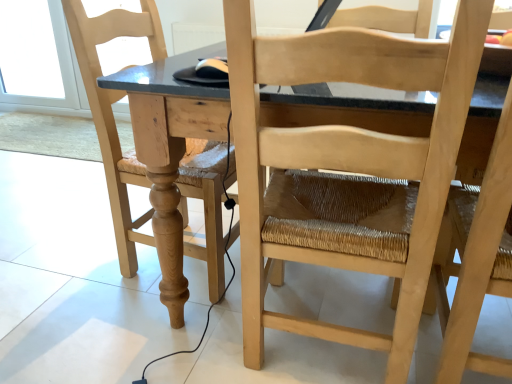
What is the approximate width of natural wood chair at center, placed as the second chair when sorted from left to right?

It is 20.10 inches.

Describe the element at coordinates (59, 67) in the screenshot. I see `transparent glass door at upper left` at that location.

The image size is (512, 384). What do you see at coordinates (347, 113) in the screenshot? I see `natural wood table at center` at bounding box center [347, 113].

Locate an element on the screen. natural wood chair at center, the 2th chair positioned from the right is located at coordinates (347, 168).

Does natural wood chair at left, the third chair positioned from the right, have a greater height compared to natural wood chair at center, the 2th chair positioned from the right?

In fact, natural wood chair at left, the third chair positioned from the right, may be shorter than natural wood chair at center, the 2th chair positioned from the right.

Considering the relative sizes of natural wood chair at left, the first chair in the left-to-right sequence, and natural wood chair at center, the 2th chair positioned from the right, in the image provided, is natural wood chair at left, the first chair in the left-to-right sequence, thinner than natural wood chair at center, the 2th chair positioned from the right,?

Indeed, natural wood chair at left, the first chair in the left-to-right sequence, has a lesser width compared to natural wood chair at center, the 2th chair positioned from the right.

Would you say natural wood chair at left, the third chair positioned from the right, is outside natural wood chair at center, placed as the second chair when sorted from left to right?

Yes, natural wood chair at left, the third chair positioned from the right, is not within natural wood chair at center, placed as the second chair when sorted from left to right.

From a real-world perspective, is natural wood chair at left, the first chair in the left-to-right sequence, above or below natural wood chair at center, placed as the second chair when sorted from left to right?

From a real-world perspective, natural wood chair at left, the first chair in the left-to-right sequence, is physically below natural wood chair at center, placed as the second chair when sorted from left to right.

Is natural wood chair at center, placed as the second chair when sorted from left to right, spatially inside natural wood table at center, or outside of it?

→ natural wood chair at center, placed as the second chair when sorted from left to right, is contained in natural wood table at center.

From a real-world perspective, is natural wood chair at center, placed as the second chair when sorted from left to right, positioned over natural wood table at center based on gravity?

Yes, from a real-world perspective, natural wood chair at center, placed as the second chair when sorted from left to right, is above natural wood table at center.

Is natural wood chair at center, the 2th chair positioned from the right, facing towards natural wood table at center?

Yes, natural wood chair at center, the 2th chair positioned from the right, is turned towards natural wood table at center.

Considering the sizes of natural wood chair at center, the 2th chair positioned from the right, and natural wood table at center in the image, is natural wood chair at center, the 2th chair positioned from the right, wider or thinner than natural wood table at center?

In the image, natural wood chair at center, the 2th chair positioned from the right, appears to be more narrow than natural wood table at center.

From the image's perspective, is natural wood chair at right, which is the 1th chair in right-to-left order, located beneath natural wood chair at center, placed as the second chair when sorted from left to right?

Indeed, from the image's perspective, natural wood chair at right, which is the 1th chair in right-to-left order, is shown beneath natural wood chair at center, placed as the second chair when sorted from left to right.

Is natural wood chair at center, placed as the second chair when sorted from left to right, at the back of natural wood chair at right, the third chair positioned from the left?

No, natural wood chair at right, the third chair positioned from the left, is not facing away from natural wood chair at center, placed as the second chair when sorted from left to right.

Is natural wood chair at right, the third chair positioned from the left, situated inside natural wood chair at center, placed as the second chair when sorted from left to right, or outside?

The correct answer is: outside.

How different are the orientations of natural wood chair at right, which is the 1th chair in right-to-left order, and natural wood chair at center, the 2th chair positioned from the right, in degrees?

The angle between the facing direction of natural wood chair at right, which is the 1th chair in right-to-left order, and the facing direction of natural wood chair at center, the 2th chair positioned from the right, is 1.54 degrees.

From a real-world perspective, is natural wood table at center positioned above or below natural wood chair at center, placed as the second chair when sorted from left to right?

Clearly, from a real-world perspective, natural wood table at center is below natural wood chair at center, placed as the second chair when sorted from left to right.

Does natural wood table at center appear on the right side of natural wood chair at center, the 2th chair positioned from the right?

Indeed, natural wood table at center is positioned on the right side of natural wood chair at center, the 2th chair positioned from the right.

From the image's perspective, is natural wood table at center located above natural wood chair at center, placed as the second chair when sorted from left to right?

Yes.

Is natural wood table at center spatially inside natural wood chair at center, placed as the second chair when sorted from left to right, or outside of it?

natural wood table at center is spatially situated outside natural wood chair at center, placed as the second chair when sorted from left to right.

Could natural wood chair at right, the third chair positioned from the left, be considered to be inside natural wood chair at center, placed as the second chair when sorted from left to right?

No, natural wood chair at right, the third chair positioned from the left, is located outside of natural wood chair at center, placed as the second chair when sorted from left to right.

Can you tell me how much natural wood chair at center, the 2th chair positioned from the right, and natural wood chair at right, the third chair positioned from the left, differ in facing direction?

There is a 1.54-degree angle between the facing directions of natural wood chair at center, the 2th chair positioned from the right, and natural wood chair at right, the third chair positioned from the left.

Between natural wood chair at center, the 2th chair positioned from the right, and natural wood chair at right, which is the 1th chair in right-to-left order, which one is positioned in front?

Positioned in front is natural wood chair at right, which is the 1th chair in right-to-left order.

Would you say natural wood chair at right, which is the 1th chair in right-to-left order, is inside or outside transparent glass door at upper left?

natural wood chair at right, which is the 1th chair in right-to-left order, cannot be found inside transparent glass door at upper left.

Are natural wood chair at right, the third chair positioned from the left, and transparent glass door at upper left far apart?

Indeed, natural wood chair at right, the third chair positioned from the left, is not near transparent glass door at upper left.

From the image's perspective, which one is positioned lower, natural wood chair at right, which is the 1th chair in right-to-left order, or transparent glass door at upper left?

natural wood chair at right, which is the 1th chair in right-to-left order, from the image's perspective.

Could you measure the distance between natural wood chair at center, placed as the second chair when sorted from left to right, and natural wood chair at left, the first chair in the left-to-right sequence?

The distance of natural wood chair at center, placed as the second chair when sorted from left to right, from natural wood chair at left, the first chair in the left-to-right sequence, is 17.58 inches.

How different are the orientations of natural wood chair at center, placed as the second chair when sorted from left to right, and natural wood chair at left, the first chair in the left-to-right sequence, in degrees?

95.2 degrees separate the facing orientations of natural wood chair at center, placed as the second chair when sorted from left to right, and natural wood chair at left, the first chair in the left-to-right sequence.

Is natural wood chair at center, the 2th chair positioned from the right, to the left or to the right of natural wood chair at left, the first chair in the left-to-right sequence, in the image?

Based on their positions, natural wood chair at center, the 2th chair positioned from the right, is located to the right of natural wood chair at left, the first chair in the left-to-right sequence.

Does natural wood chair at center, placed as the second chair when sorted from left to right, turn towards natural wood chair at left, the first chair in the left-to-right sequence?

No.

Locate an element on the screen. The image size is (512, 384). chair that is the 1st one below the natural wood chair at center, placed as the second chair when sorted from left to right (from a real-world perspective) is located at coordinates (112, 112).

The image size is (512, 384). Identify the location of table above the natural wood chair at center, placed as the second chair when sorted from left to right (from the image's perspective). [347, 113].

When comparing their distances from transparent glass door at upper left, does natural wood chair at right, the third chair positioned from the left, or natural wood chair at left, the third chair positioned from the right, seem further?

natural wood chair at right, the third chair positioned from the left, lies further to transparent glass door at upper left than the other object.

When comparing their distances from natural wood chair at center, placed as the second chair when sorted from left to right, does natural wood chair at right, which is the 1th chair in right-to-left order, or transparent glass door at upper left seem further?

transparent glass door at upper left is further to natural wood chair at center, placed as the second chair when sorted from left to right.

From the image, which object appears to be farther from transparent glass door at upper left, natural wood table at center or natural wood chair at left, the third chair positioned from the right?

natural wood table at center is positioned further to the anchor transparent glass door at upper left.

Based on their spatial positions, is natural wood chair at right, the third chair positioned from the left, or natural wood table at center further from natural wood chair at center, placed as the second chair when sorted from left to right?

natural wood chair at right, the third chair positioned from the left, is further to natural wood chair at center, placed as the second chair when sorted from left to right.

Estimate the real-world distances between objects in this image. Which object is further from natural wood chair at center, the 2th chair positioned from the right, natural wood chair at left, the first chair in the left-to-right sequence, or natural wood chair at right, the third chair positioned from the left?

natural wood chair at left, the first chair in the left-to-right sequence, is further to natural wood chair at center, the 2th chair positioned from the right.

Which object lies further to the anchor point natural wood chair at left, the first chair in the left-to-right sequence, natural wood table at center or natural wood chair at right, which is the 1th chair in right-to-left order?

natural wood chair at right, which is the 1th chair in right-to-left order, is further to natural wood chair at left, the first chair in the left-to-right sequence.

Looking at the image, which one is located closer to transparent glass door at upper left, natural wood chair at left, the first chair in the left-to-right sequence, or natural wood table at center?

Among the two, natural wood chair at left, the first chair in the left-to-right sequence, is located nearer to transparent glass door at upper left.

Considering their positions, is natural wood chair at left, the third chair positioned from the right, positioned further to natural wood table at center than transparent glass door at upper left?

transparent glass door at upper left lies further to natural wood table at center than the other object.

This screenshot has height=384, width=512. Identify the location of chair between natural wood chair at left, the first chair in the left-to-right sequence, and natural wood chair at right, which is the 1th chair in right-to-left order, from left to right. (347, 168).

The width and height of the screenshot is (512, 384). In order to click on table between natural wood chair at center, placed as the second chair when sorted from left to right, and transparent glass door at upper left from front to back in this screenshot , I will do `click(347, 113)`.

Find the location of a particular element. The image size is (512, 384). table located between natural wood chair at left, the third chair positioned from the right, and natural wood chair at right, which is the 1th chair in right-to-left order, in the left-right direction is located at coordinates (347, 113).

The image size is (512, 384). What are the coordinates of `chair located between natural wood table at center and transparent glass door at upper left in the depth direction` in the screenshot? It's located at (112, 112).